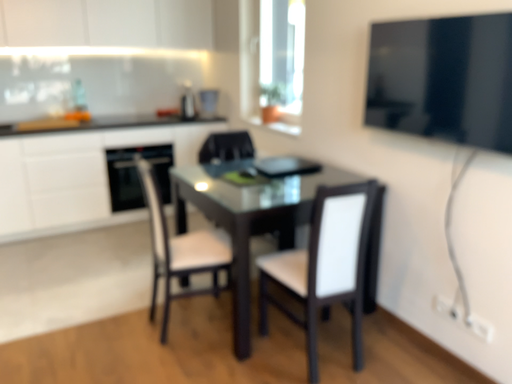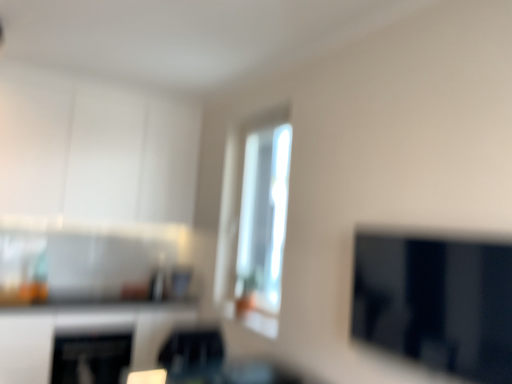
Question: Which way did the camera rotate in the video?

Choices:
 (A) rotated upward
 (B) rotated downward

Answer: (A)